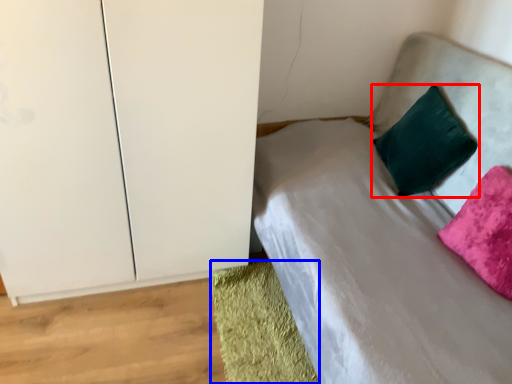
Question: Which of the following is the closest to the observer, pillow (highlighted by a red box) or material (highlighted by a blue box)?

Choices:
 (A) pillow
 (B) material

Answer: (B)